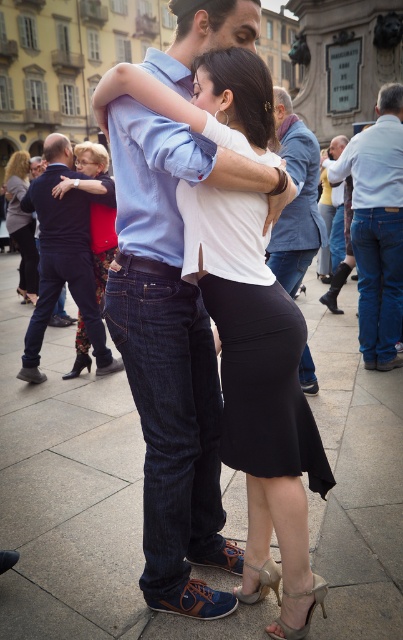
You are standing in the plaza and want to take a photo of the dance scene. The camera you have can only focus on objects within 8 feet. Is the point at coordinates point (261, 330) within the focus range of your camera?

The point at coordinates point (261, 330) is 9.32 feet from the camera, which is beyond the camera focus range of 8 feet. Therefore, the camera cannot focus on that point.

You are a photographer standing in the plaza and you want to capture a photo of the jeans at right and denim jeans at center. Which pair of jeans is positioned lower in the image?

The jeans at right is positioned below denim jeans at center, so the jeans at right is lower in the image.